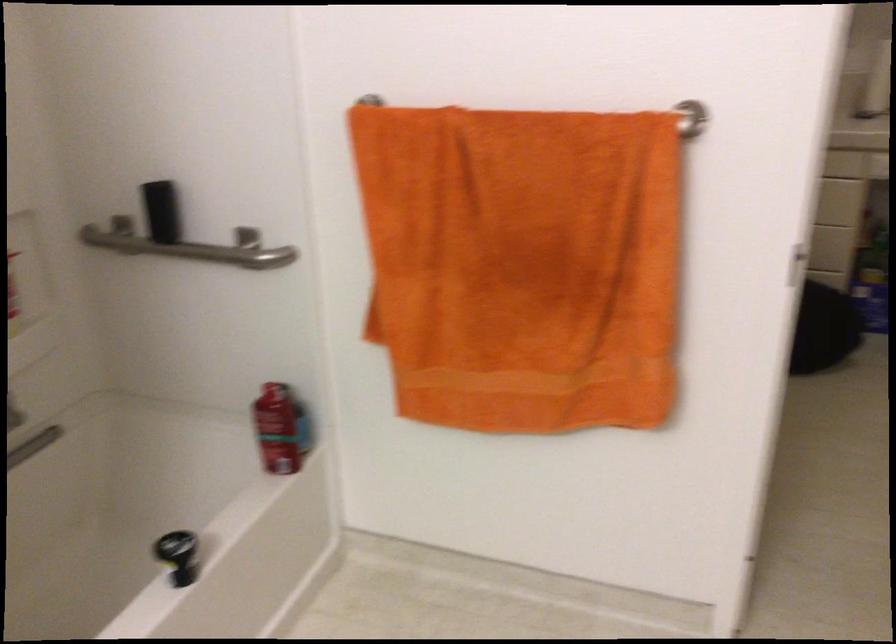
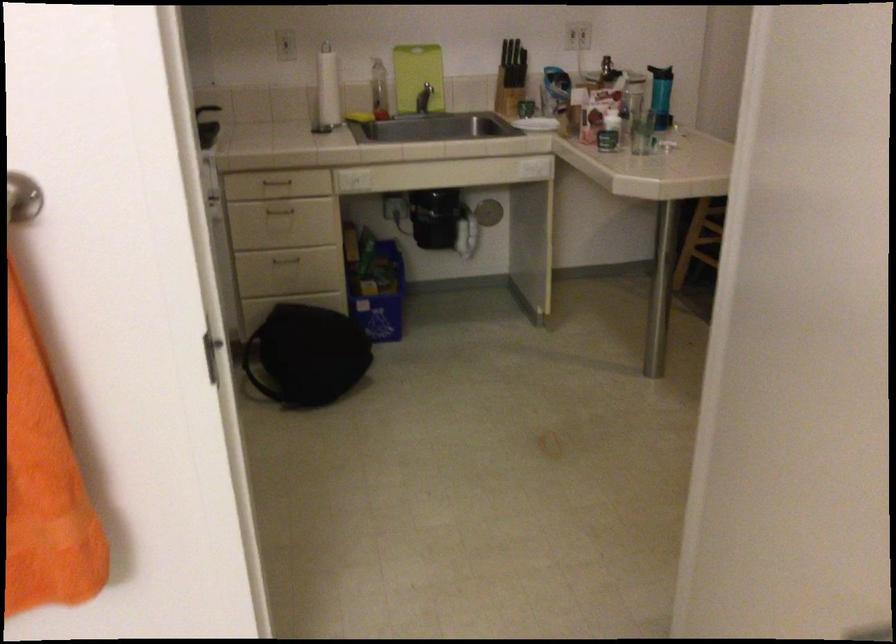
Where in the second image is the point corresponding to point (796, 324) from the first image?

(306, 355)